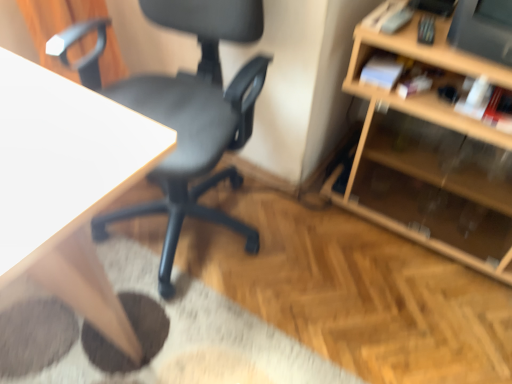
Find the location of a particular element. The image size is (512, 384). vacant space in between black plastic chair at center and wooden shelf at right is located at coordinates (340, 258).